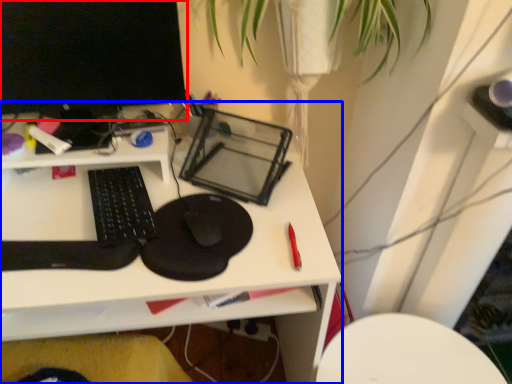
Question: Which of the following is the farthest to the observer, computer monitor (highlighted by a red box) or desk (highlighted by a blue box)?

Choices:
 (A) computer monitor
 (B) desk

Answer: (A)